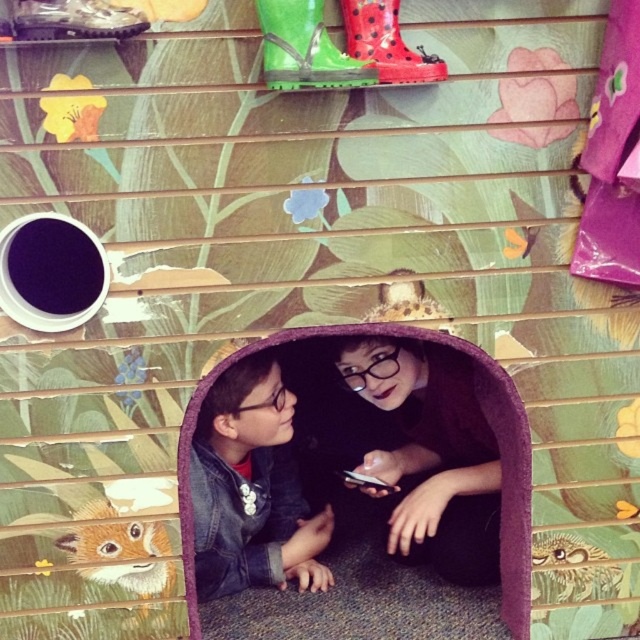
How distant is denim jacket at lower center from brown furry fox at lower left?

The distance of denim jacket at lower center from brown furry fox at lower left is 9.09 inches.

Does denim jacket at lower center have a greater width compared to brown furry fox at lower left?

Yes, denim jacket at lower center is wider than brown furry fox at lower left.

Does point (324, 518) come in front of point (83, 538)?

No.

Find the location of a particular element. denim jacket at lower center is located at coordinates (252, 486).

Is point (461, 362) behind point (76, 556)?

Yes, it is behind point (76, 556).

At what (x,y) coordinates should I click in order to perform the action: click on matte black jacket at lower left. Please return your answer as a coordinate pair (x, y). Looking at the image, I should click on (428, 452).

Between matte black jacket at lower left and denim jacket at lower center, which one is positioned higher?

matte black jacket at lower left is above.

Does matte black jacket at lower left have a larger size compared to denim jacket at lower center?

Correct, matte black jacket at lower left is larger in size than denim jacket at lower center.

Is point (420, 352) farther from camera compared to point (252, 520)?

Yes, it is.

Where is `matte black jacket at lower left`? The image size is (640, 640). matte black jacket at lower left is located at coordinates (428, 452).